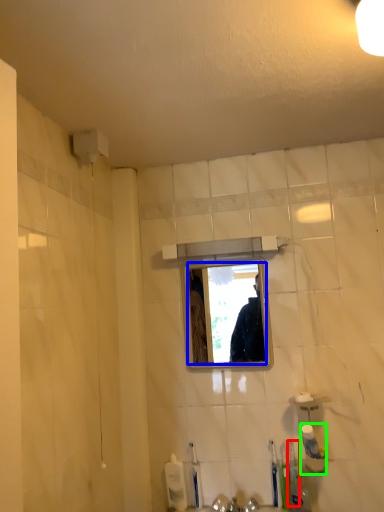
Question: Which object is positioned closest to toothbrush (highlighted by a red box)? Select from mirror (highlighted by a blue box) and toiletry (highlighted by a green box).

Choices:
 (A) mirror
 (B) toiletry

Answer: (B)